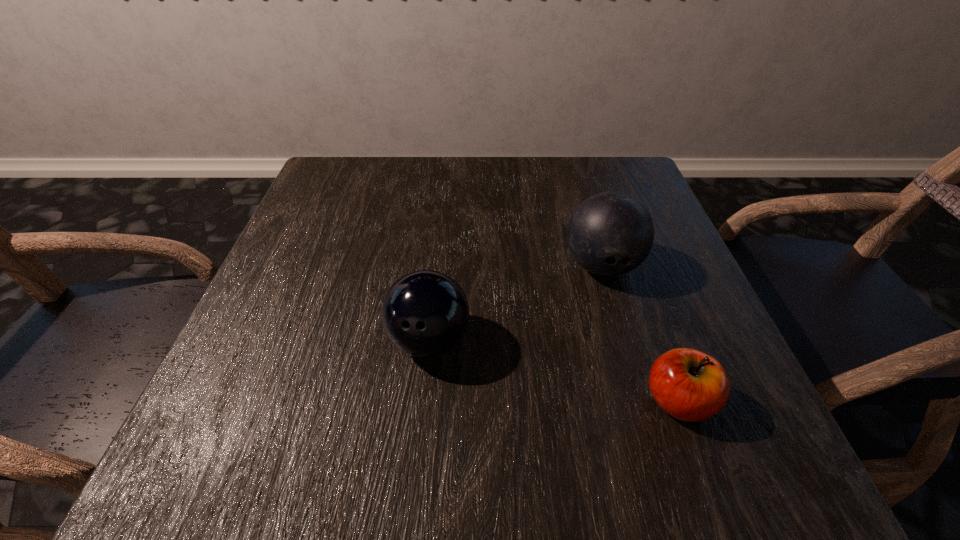
Where is `object that is the closest to the apple`? The width and height of the screenshot is (960, 540). object that is the closest to the apple is located at coordinates (610, 233).

At what (x,y) coordinates should I click in order to perform the action: click on vacant space that satisfies the following two spatial constraints: 1. on the grip area of the shortest object; 2. on the right side of the farther bowling ball. Please return your answer as a coordinate pair (x, y). This screenshot has width=960, height=540. Looking at the image, I should click on (641, 401).

Locate an element on the screen. The width and height of the screenshot is (960, 540). vacant space that satisfies the following two spatial constraints: 1. on the side of the shortest object with the finger holes; 2. on the left side of the leftmost object is located at coordinates (423, 401).

The width and height of the screenshot is (960, 540). I want to click on vacant region that satisfies the following two spatial constraints: 1. on the grip area of the farthest object; 2. on the right side of the shortest object, so click(x=641, y=401).

The height and width of the screenshot is (540, 960). I want to click on free spot that satisfies the following two spatial constraints: 1. on the grip area of the shortest object; 2. on the left side of the farther bowling ball, so click(x=641, y=401).

Find the location of a particular element. Image resolution: width=960 pixels, height=540 pixels. vacant space that satisfies the following two spatial constraints: 1. on the grip area of the apple; 2. on the right side of the farthest object is located at coordinates (641, 401).

Image resolution: width=960 pixels, height=540 pixels. Identify the location of vacant position in the image that satisfies the following two spatial constraints: 1. on the side of the shortest object with the finger holes; 2. on the right side of the leftmost object. (423, 401).

The image size is (960, 540). What are the coordinates of `vacant region that satisfies the following two spatial constraints: 1. on the side of the left bowling ball with the finger holes; 2. on the left side of the shortest object` in the screenshot? It's located at (423, 401).

Where is `vacant region that satisfies the following two spatial constraints: 1. on the side of the apple with the finger holes; 2. on the left side of the nearer bowling ball`? The height and width of the screenshot is (540, 960). vacant region that satisfies the following two spatial constraints: 1. on the side of the apple with the finger holes; 2. on the left side of the nearer bowling ball is located at coordinates [423, 401].

The height and width of the screenshot is (540, 960). I want to click on free space that satisfies the following two spatial constraints: 1. on the side of the apple with the finger holes; 2. on the left side of the left bowling ball, so click(423, 401).